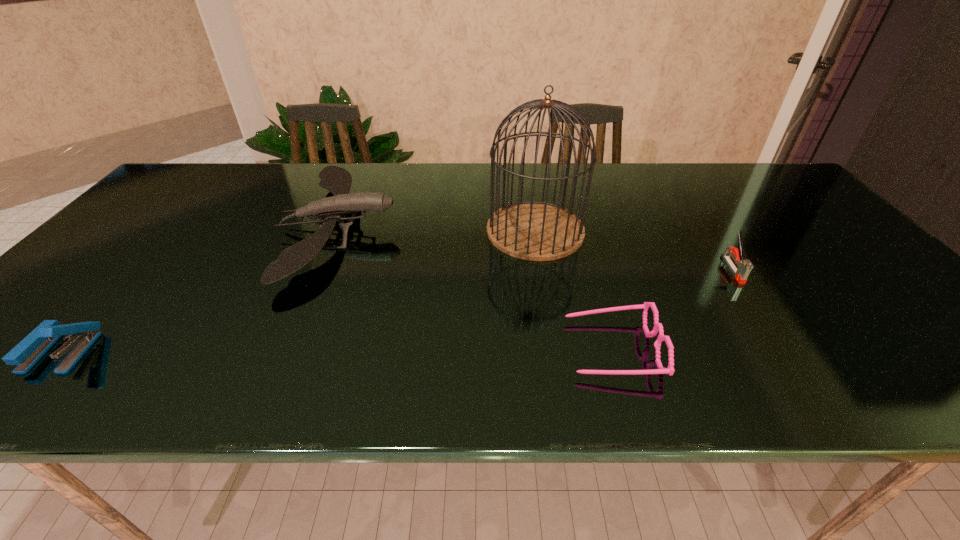
I want to click on vacant area that lies between the shortest object and the farther stapler, so click(672, 309).

The image size is (960, 540). Identify the location of vacant space that's between the shortest object and the leftmost object. (337, 350).

Image resolution: width=960 pixels, height=540 pixels. What are the coordinates of `vacant space in between the birdcage and the shortest object` in the screenshot? It's located at 573,289.

Locate an element on the screen. vacant area that lies between the right stapler and the shortest object is located at coordinates (672, 309).

Identify the location of vacant region between the birdcage and the drone. This screenshot has width=960, height=540. (437, 230).

Identify the location of object that stands as the fourth closest to the left stapler. (745, 266).

Identify which object is the second nearest to the second object from left to right. Please provide its 2D coordinates. Your answer should be formatted as a tuple, i.e. [(x, y)], where the tuple contains the x and y coordinates of a point satisfying the conditions above.

[(30, 350)]

The image size is (960, 540). I want to click on vacant region that satisfies the following two spatial constraints: 1. on the arms of the shortest object; 2. on the front side of the left stapler, so click(612, 351).